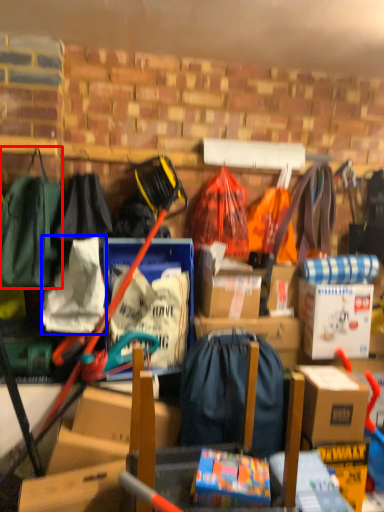
Question: Which object appears closest to the camera in this image, clothing (highlighted by a red box) or clothing (highlighted by a blue box)?

Choices:
 (A) clothing
 (B) clothing

Answer: (A)